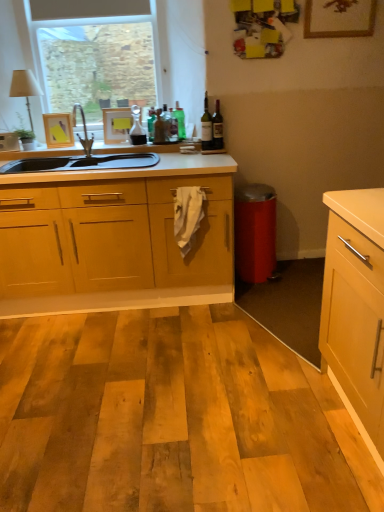
Question: Is translucent glass wine bottle at upper center, acting as the first bottle starting from the right, inside or outside of wooden photo frame at upper left, the second picture frame from the front?

Choices:
 (A) inside
 (B) outside

Answer: (B)

Question: Does point (213, 128) appear closer or farther from the camera than point (69, 143)?

Choices:
 (A) farther
 (B) closer

Answer: (B)

Question: Which of these objects is positioned closest to the metallic faucet at upper left?

Choices:
 (A) translucent glass wine bottle at upper center, the 4th bottle from the left
 (B) matte white picture frame at upper center, which appears as the second picture frame when ordered from the bottom
 (C) translucent glass carafe at center, positioned as the 1th bottle in left-to-right order
 (D) wooden picture frame at upper center, which is counted as the 1th picture frame, starting from the top
 (E) translucent glass wine bottle at upper center, the third bottle viewed from the left

Answer: (B)

Question: Considering the real-world distances, which object is closest to the green glass bottle at upper center, the 2th bottle from the left?

Choices:
 (A) translucent glass carafe at center, positioned as the 1th bottle in left-to-right order
 (B) wooden picture frame at upper center, the first picture frame viewed from the front
 (C) matte white picture frame at upper center, marked as the second picture frame in a top-to-bottom arrangement
 (D) metallic faucet at upper left
 (E) translucent glass wine bottle at upper center, acting as the first bottle starting from the right

Answer: (A)